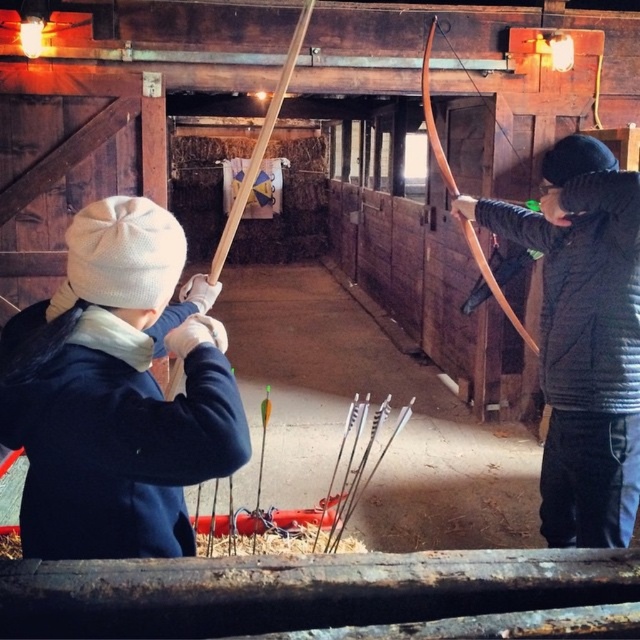
Question: Considering the relative positions of matte blue jacket at left and wooden bow at center in the image provided, where is matte blue jacket at left located with respect to wooden bow at center?

Choices:
 (A) right
 (B) left

Answer: (B)

Question: Which of these objects is positioned farthest from the matte blue jacket at left?

Choices:
 (A) wooden bow at center
 (B) matte black jacket at right

Answer: (A)

Question: Where is matte blue jacket at left located in relation to matte black jacket at right in the image?

Choices:
 (A) above
 (B) below

Answer: (A)

Question: From the image, what is the correct spatial relationship of matte black jacket at right in relation to wooden bow at center?

Choices:
 (A) below
 (B) above

Answer: (A)

Question: Which object is closer to the camera taking this photo?

Choices:
 (A) matte blue jacket at left
 (B) matte black jacket at right
 (C) wooden bow at center

Answer: (A)

Question: Which of the following is the closest to the observer?

Choices:
 (A) (426, 77)
 (B) (141, 212)
 (C) (595, 506)

Answer: (B)